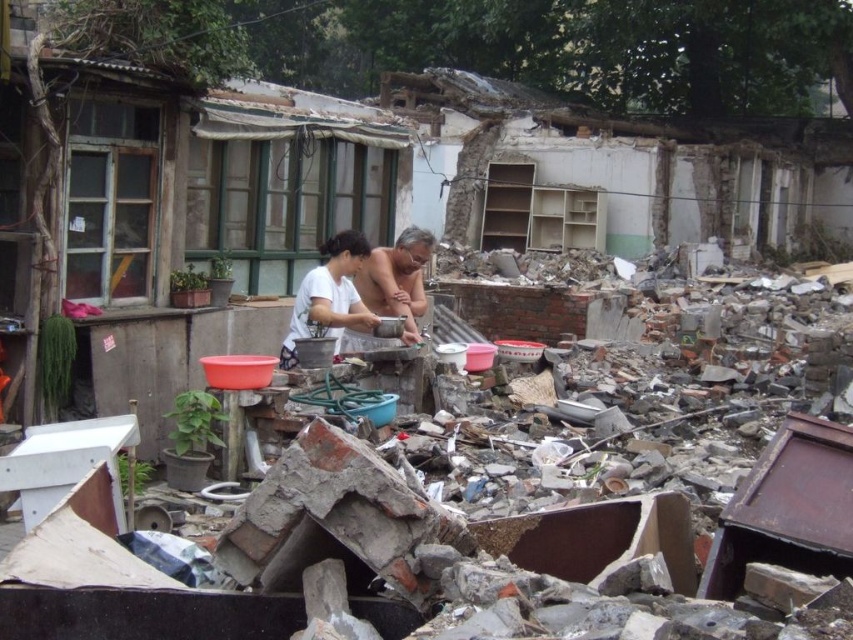
Is white matte shirt at center above smooth skin man at center?

Actually, white matte shirt at center is below smooth skin man at center.

Who is lower down, white matte shirt at center or smooth skin man at center?

white matte shirt at center

Locate an element on the screen. The image size is (853, 640). white matte shirt at center is located at coordinates (368, 284).

I want to click on white matte shirt at center, so click(368, 284).